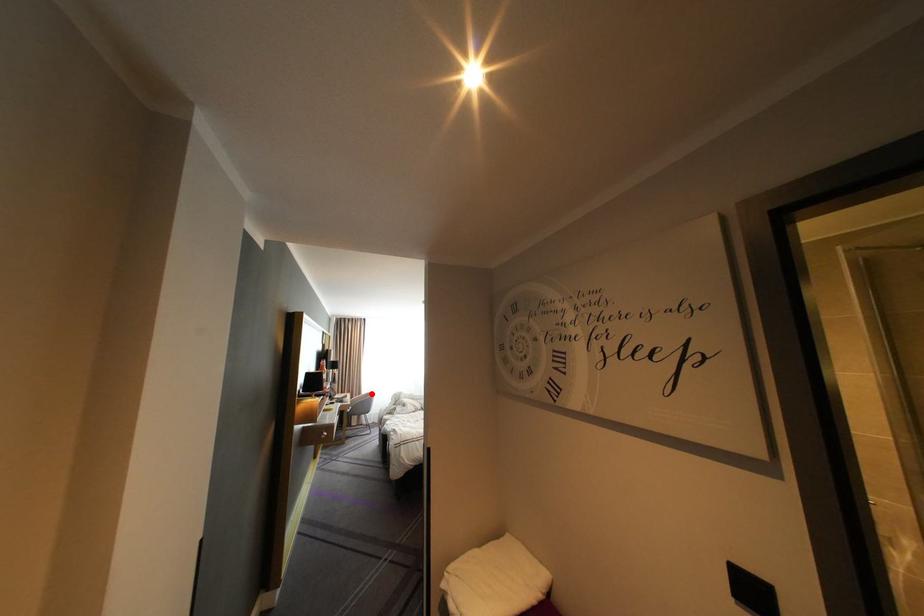
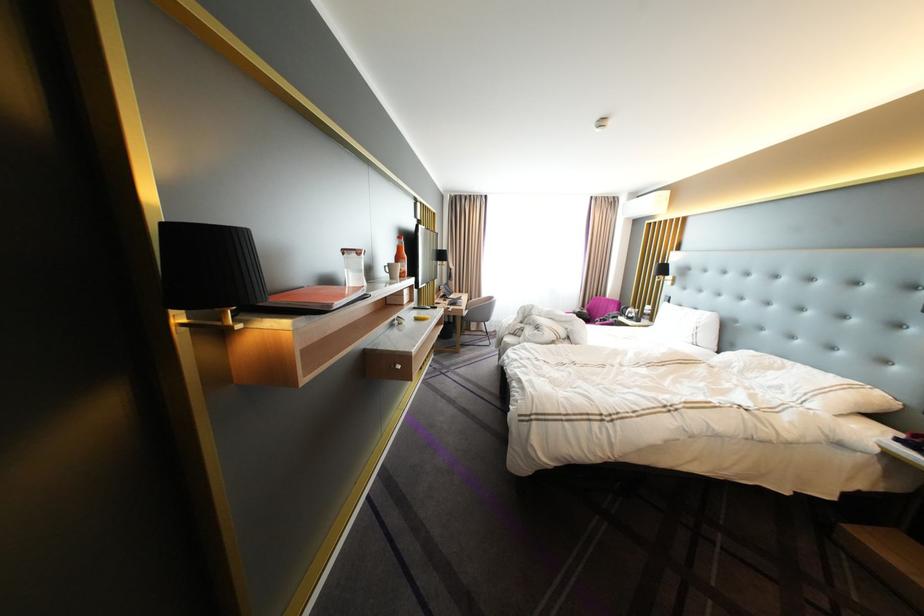
In the second image, find the point that corresponds to the highlighted location in the first image.

(492, 296)